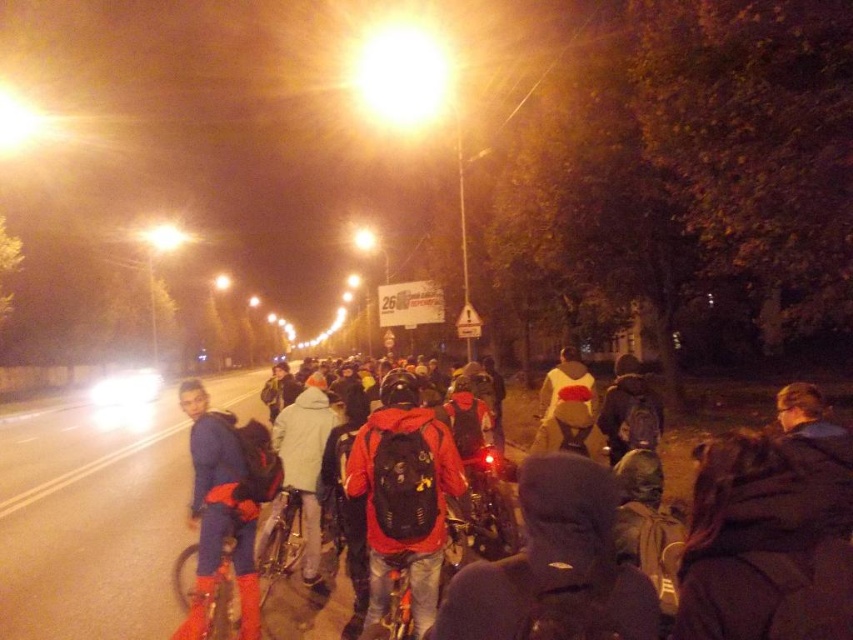
Question: Can you confirm if red backpack at center is thinner than blue fabric jacket at left?

Choices:
 (A) no
 (B) yes

Answer: (B)

Question: Which of the following is the farthest from the observer?

Choices:
 (A) (541, 456)
 (B) (207, 410)

Answer: (B)

Question: Among these points, which one is farthest from the camera?

Choices:
 (A) (360, 440)
 (B) (189, 442)

Answer: (B)

Question: Is matte red jacket at center further to camera compared to blue fabric jacket at left?

Choices:
 (A) no
 (B) yes

Answer: (A)

Question: Which point appears farthest from the camera in this image?

Choices:
 (A) (200, 403)
 (B) (503, 563)
 (C) (415, 621)

Answer: (A)

Question: In this image, where is matte red jacket at center located relative to blue fabric jacket at left?

Choices:
 (A) above
 (B) below

Answer: (A)